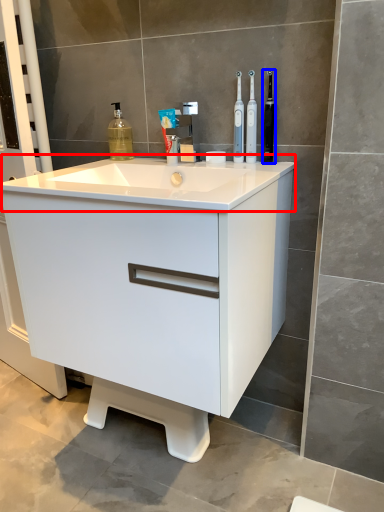
Question: Which point is closer to the camera, counter top (highlighted by a red box) or toothbrush (highlighted by a blue box)?

Choices:
 (A) counter top
 (B) toothbrush

Answer: (A)